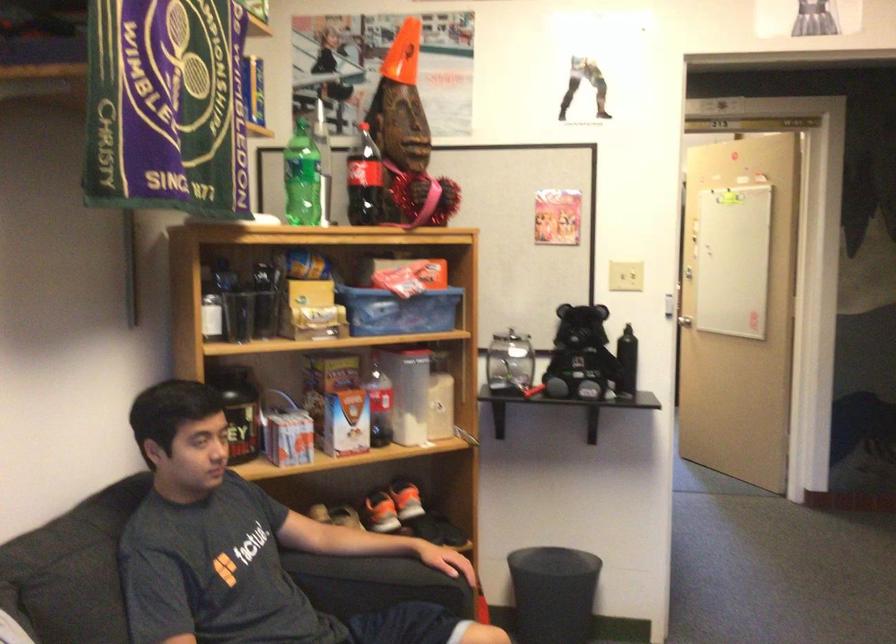
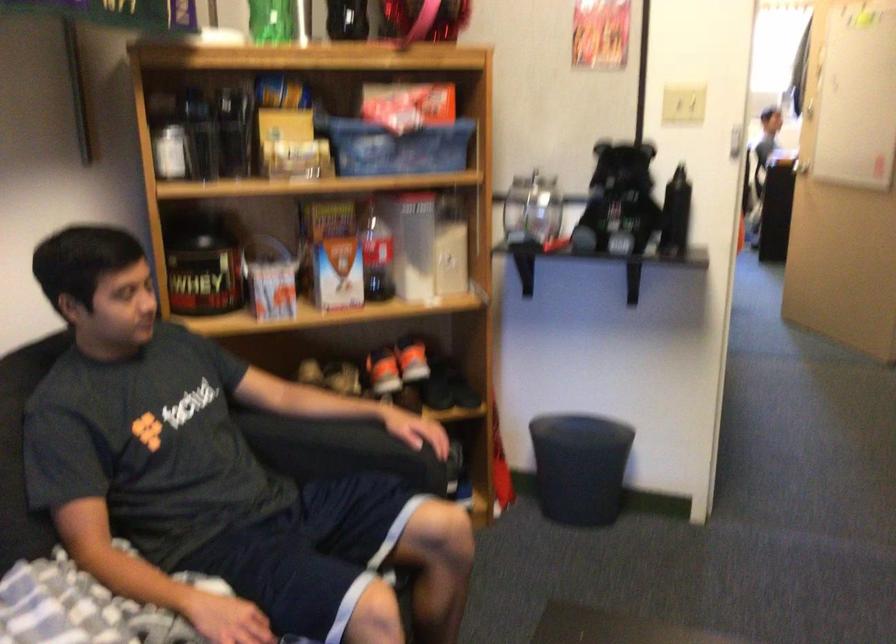
Find the pixel in the second image that matches (x=409, y=498) in the first image.

(411, 359)